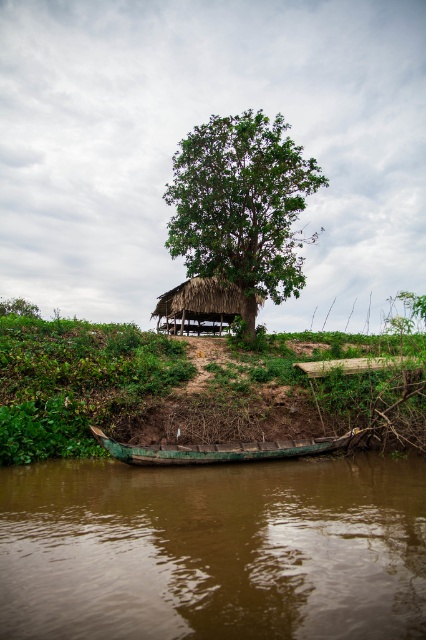
Between point (132, 444) and point (157, 308), which one is positioned in front?

Point (132, 444)

Does green wooden boat at lower center have a smaller size compared to thatched straw hut at center?

Indeed, green wooden boat at lower center has a smaller size compared to thatched straw hut at center.

Where is `green wooden boat at lower center`? green wooden boat at lower center is located at coordinates (219, 449).

Which is above, brown muddy water at lower center or green wooden boat at lower center?

brown muddy water at lower center is higher up.

This screenshot has height=640, width=426. I want to click on brown muddy water at lower center, so click(x=213, y=550).

Which is behind, point (51, 465) or point (104, 444)?

Positioned behind is point (51, 465).

The width and height of the screenshot is (426, 640). I want to click on brown muddy water at lower center, so click(213, 550).

Is point (42, 540) more distant than point (285, 138)?

No.

Looking at this image, between brown muddy water at lower center and green leafy tree at center, which one has less height?

Standing shorter between the two is brown muddy water at lower center.

Find the location of `brown muddy water at lower center`. brown muddy water at lower center is located at coordinates [213, 550].